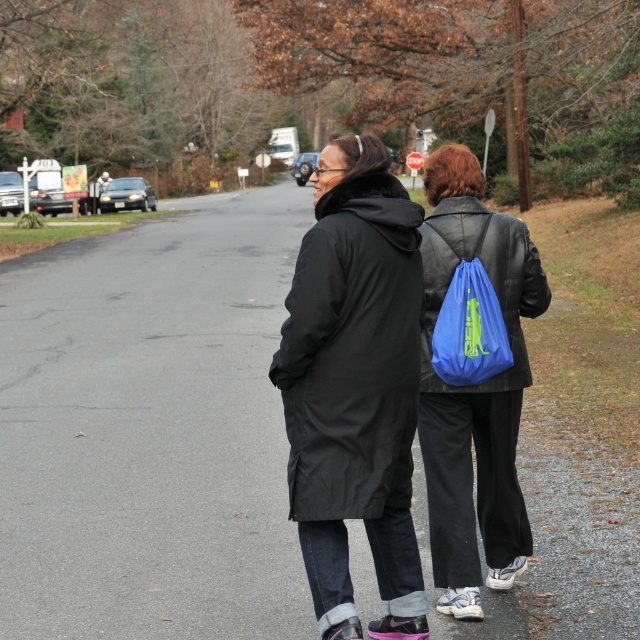
Question: Which object is farther from the camera taking this photo?

Choices:
 (A) matte black jacket at center
 (B) blue fabric backpack at center-right
 (C) blue fabric backpack at right

Answer: (B)

Question: Where is matte black jacket at center located in relation to blue fabric backpack at center-right in the image?

Choices:
 (A) left
 (B) right

Answer: (A)

Question: Among these points, which one is farthest from the camera?

Choices:
 (A) (508, 406)
 (B) (275, 365)
 (C) (493, 344)

Answer: (A)

Question: Which point appears farthest from the camera in this image?

Choices:
 (A) (509, 481)
 (B) (545, 292)

Answer: (B)

Question: Is blue fabric backpack at right wider than blue fabric backpack at center-right?

Choices:
 (A) yes
 (B) no

Answer: (A)

Question: Can you confirm if matte black jacket at center is smaller than blue fabric backpack at center-right?

Choices:
 (A) yes
 (B) no

Answer: (B)